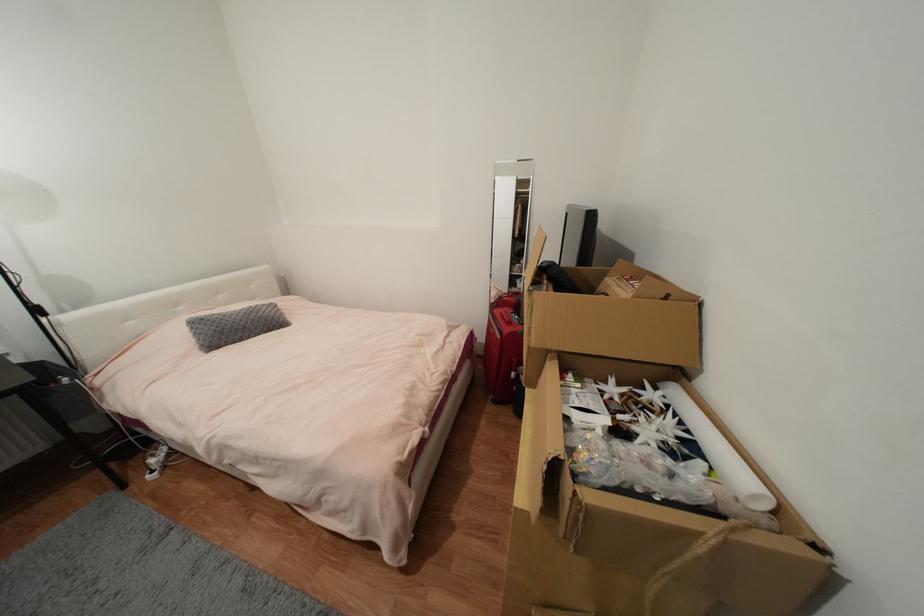
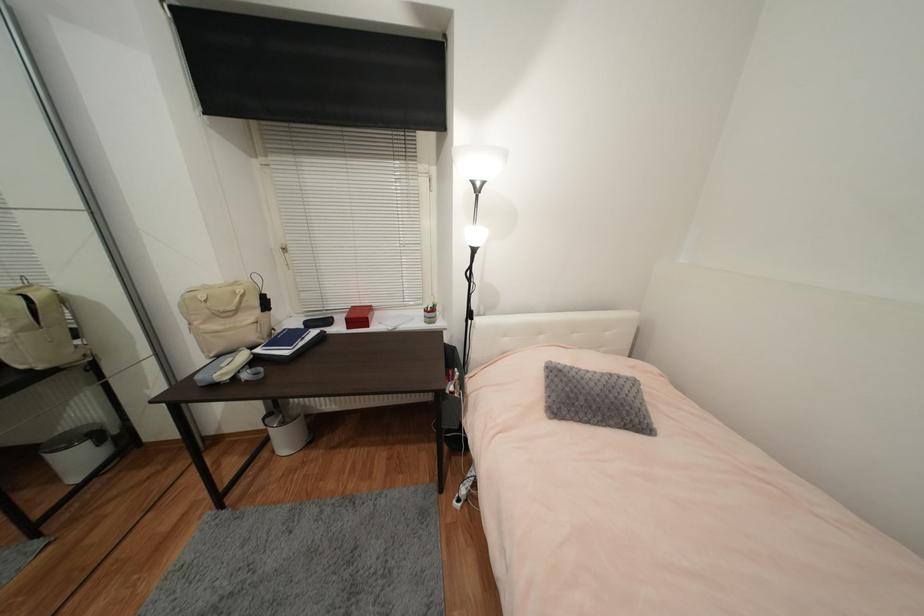
Locate, in the second image, the point that corresponds to point (244, 320) in the first image.

(602, 391)